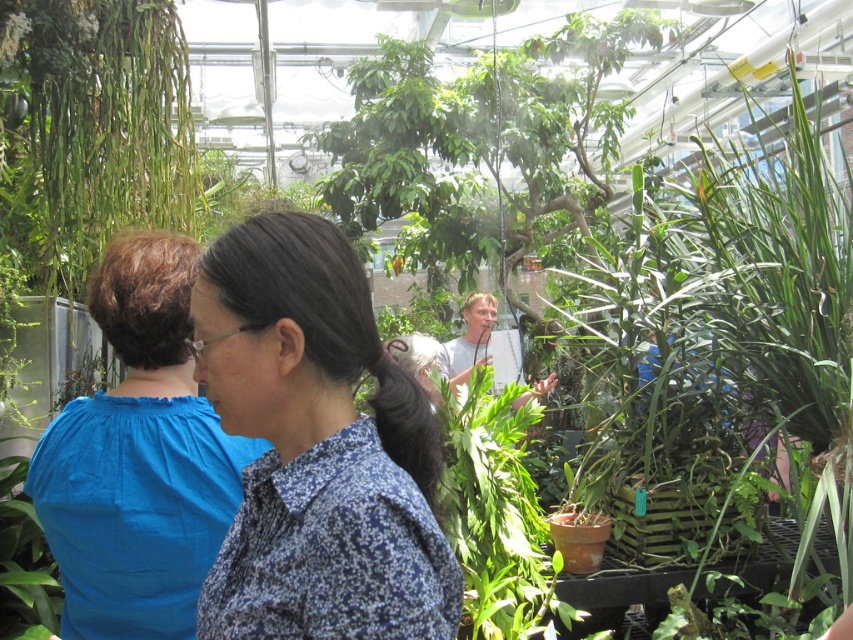
Question: Which object is closer to the camera taking this photo?

Choices:
 (A) blue printed shirt at center
 (B) blue cotton blouse at left

Answer: (A)

Question: Which point appears farthest from the camera in this image?

Choices:
 (A) (126, 561)
 (B) (322, 394)

Answer: (A)

Question: Can you confirm if blue cotton blouse at left is wider than green matte leaf at center?

Choices:
 (A) yes
 (B) no

Answer: (B)

Question: Is blue cotton blouse at left above green matte leaf at center?

Choices:
 (A) yes
 (B) no

Answer: (A)

Question: Is blue printed shirt at center wider than blue cotton blouse at left?

Choices:
 (A) no
 (B) yes

Answer: (A)

Question: Which of these objects is positioned closest to the blue printed shirt at center?

Choices:
 (A) green matte leaf at center
 (B) blue cotton blouse at left

Answer: (B)